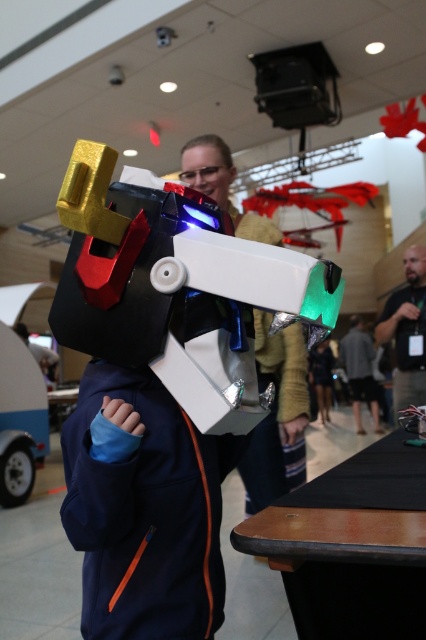
Question: Estimate the real-world distances between objects in this image. Which object is farther from the matte black helmet at center?

Choices:
 (A) dark brown leather jacket at lower right
 (B) dark gray fabric jacket at center
 (C) matte plastic head at center

Answer: (C)

Question: Can you confirm if dark gray fabric jacket at center is smaller than matte black helmet at center?

Choices:
 (A) no
 (B) yes

Answer: (A)

Question: Which point is closer to the camera?

Choices:
 (A) (360, 429)
 (B) (206, 173)

Answer: (B)

Question: Does dark brown hair at center appear under matte black helmet at center?

Choices:
 (A) yes
 (B) no

Answer: (B)

Question: Which object is farther from the camera taking this photo?

Choices:
 (A) dark gray fabric jacket at center
 (B) dark brown leather jacket at lower right
 (C) matte plastic head at center

Answer: (A)

Question: Can you confirm if dark brown leather jacket at lower right is positioned to the left of dark brown hair at center?

Choices:
 (A) yes
 (B) no

Answer: (A)